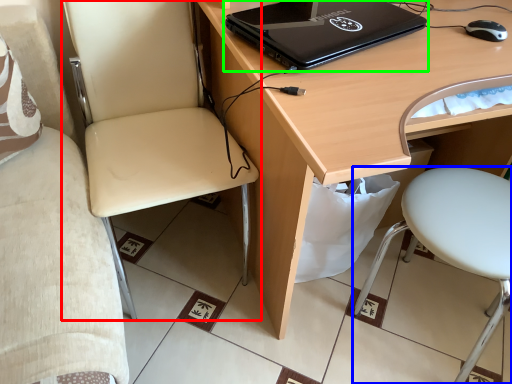
Question: Considering the real-world distances, which object is farthest from chair (highlighted by a red box)? chair (highlighted by a blue box) or laptop (highlighted by a green box)?

Choices:
 (A) chair
 (B) laptop

Answer: (A)